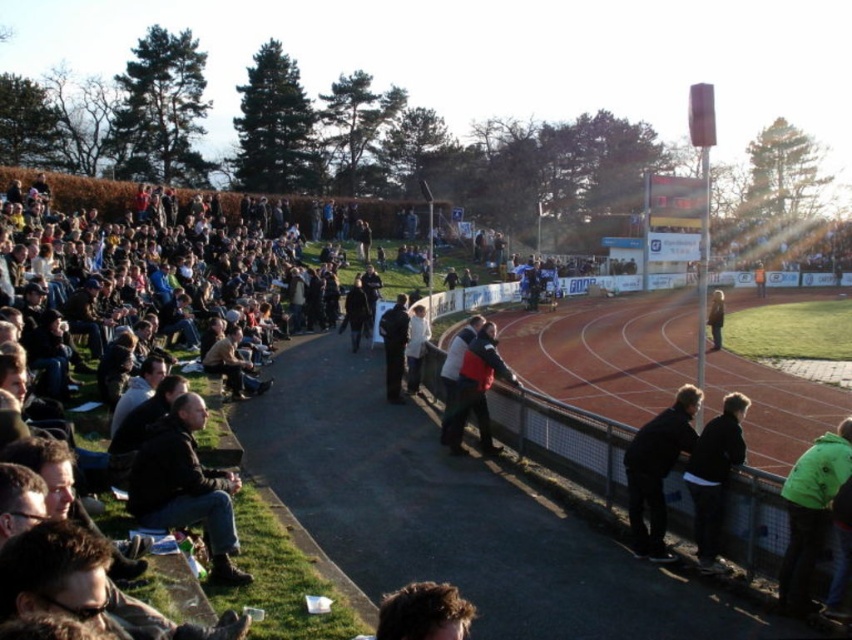
Is dark brown leather jacket at lower left positioned at the back of white cotton jacket at center?

No.

Is point (181, 490) in front of point (407, 339)?

Yes, it is.

Identify the location of dark brown leather jacket at lower left. This screenshot has width=852, height=640. (185, 486).

Does point (412, 324) lie in front of point (364, 308)?

Yes.

Which is behind, point (409, 352) or point (360, 328)?

Point (360, 328)

Locate an element on the screen. Image resolution: width=852 pixels, height=640 pixels. white cotton jacket at center is located at coordinates coord(415,346).

Between point (802, 528) and point (717, 332), which one is positioned behind?

Positioned behind is point (717, 332).

Is point (789, 492) positioned behind point (711, 314)?

No, (789, 492) is in front of (711, 314).

You are a GUI agent. You are given a task and a screenshot of the screen. Output one action in this format:
    pyautogui.click(x=<x>, y=<y>)
    Task: Click on the green fleece jacket at lower right
    The image size is (852, 640).
    Given the screenshot: What is the action you would take?
    pyautogui.click(x=810, y=513)